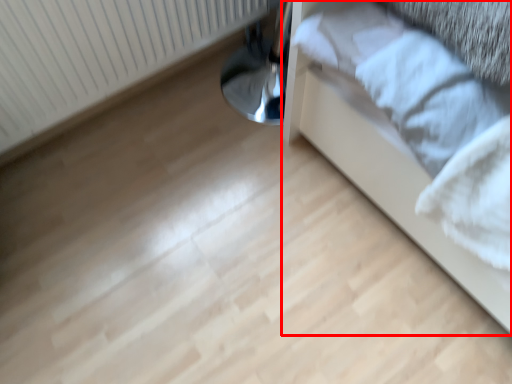
Question: From the image's perspective, where is furniture (annotated by the red box) located relative to radiator?

Choices:
 (A) above
 (B) below

Answer: (B)